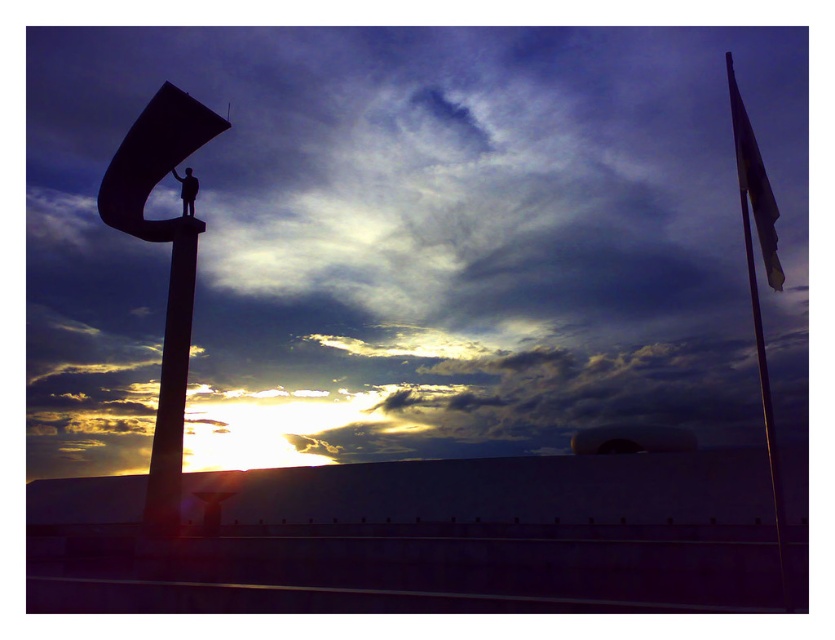
You are standing at the center of the image and want to take a photo of the smooth concrete pole at center. In which direction should you point your camera to capture it?

The smooth concrete pole at center is already at the center of the image, so you should point your camera directly forward to capture it.

You are an artist planning to paint this scene. You need to ensure that the silhouette concrete sculpture at center and the yellow fabric flag at upper right are proportionally accurate. Which object should you make wider in your painting to maintain the correct proportions?

The yellow fabric flag at upper right should be made wider in the painting because the silhouette concrete sculpture at center is narrower than the yellow fabric flag at upper right according to the description.

You are standing at the base of the monument and looking towards the horizon. There are two points marked on your map at coordinates point (191, 243) and point (757, 173). Which point is closer to you?

Point (191, 243) is behind point (757, 173), so the closer point to you is point (757, 173).